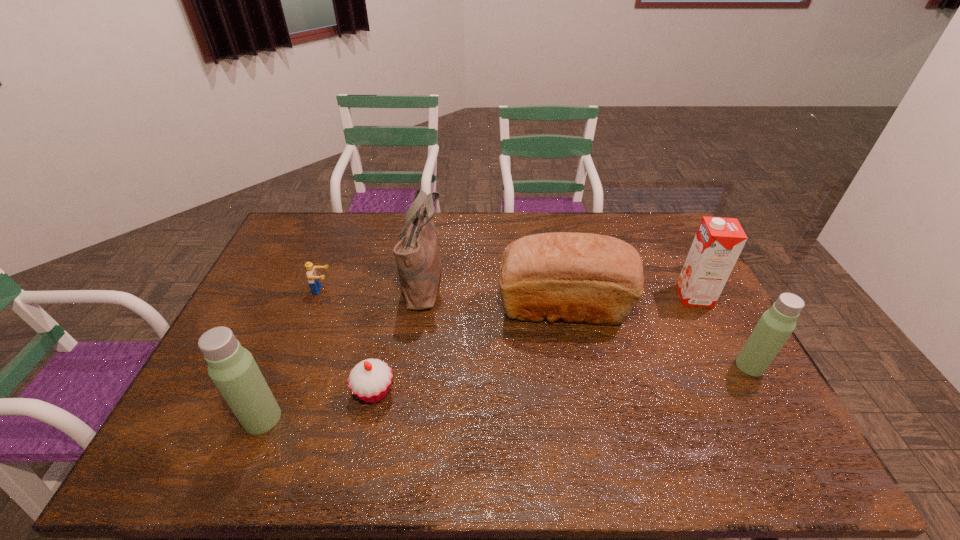
To make them evenly spaced by inserting another thermos_bottle among them, please locate a free space for this new thermos_bottle. Please provide its 2D coordinates. Your answer should be formatted as a tuple, i.e. [(x, y)], where the tuple contains the x and y coordinates of a point satisfying the conditions above.

[(518, 390)]